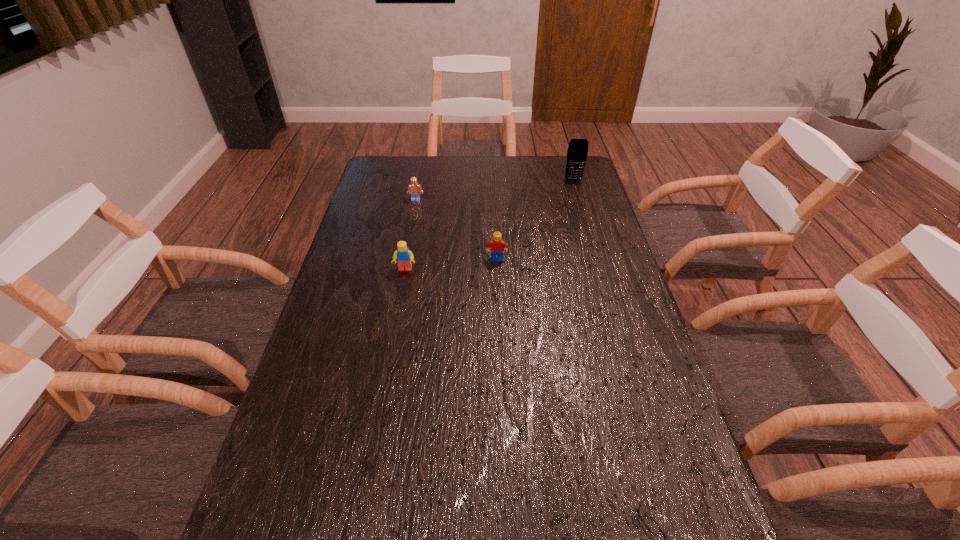
Where is `object that is at the far edge`? object that is at the far edge is located at coordinates (577, 152).

You are a GUI agent. You are given a task and a screenshot of the screen. Output one action in this format:
    pyautogui.click(x=<x>, y=<y>)
    Task: Click on the object that is at the right edge
    The height and width of the screenshot is (540, 960).
    Given the screenshot: What is the action you would take?
    pyautogui.click(x=577, y=152)

Locate an element on the screen. object positioned at the far right corner is located at coordinates (577, 152).

Identify the location of free space at the far edge of the desktop. The width and height of the screenshot is (960, 540). (483, 164).

Identify the location of vacant space at the left edge of the desktop. (377, 193).

In the image, there is a desktop. Where is `vacant space at the right edge`? vacant space at the right edge is located at coordinates [x=589, y=251].

Image resolution: width=960 pixels, height=540 pixels. What are the coordinates of `blank space at the far left corner of the desktop` in the screenshot? It's located at (386, 165).

Image resolution: width=960 pixels, height=540 pixels. I want to click on unoccupied area between the second farthest object and the tallest object, so click(494, 190).

Locate an element on the screen. The width and height of the screenshot is (960, 540). unoccupied position between the farthest object and the third object from right to left is located at coordinates (535, 219).

Identify the location of free space that is in between the rightmost Lego and the nearest Lego. (451, 264).